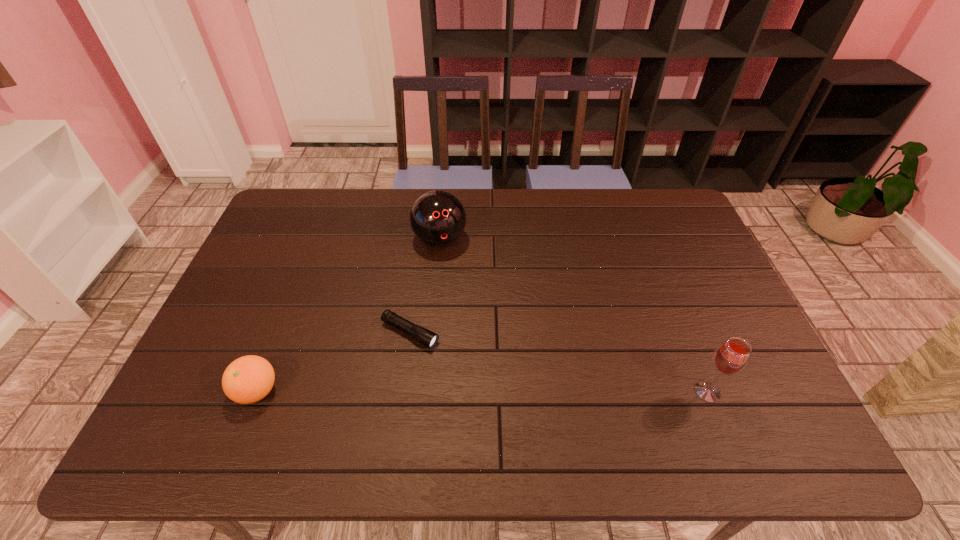
Where is `vacant area that lies between the farthest object and the leftmost object`? This screenshot has height=540, width=960. vacant area that lies between the farthest object and the leftmost object is located at coordinates (348, 315).

Image resolution: width=960 pixels, height=540 pixels. Find the location of `vacant space that's between the second farthest object and the orange`. vacant space that's between the second farthest object and the orange is located at coordinates (333, 362).

The height and width of the screenshot is (540, 960). In order to click on free space that is in between the orange and the shortest object in this screenshot , I will do `click(333, 362)`.

At what (x,y) coordinates should I click in order to perform the action: click on free space between the farthest object and the rightmost object. Please return your answer as a coordinate pair (x, y). This screenshot has width=960, height=540. Looking at the image, I should click on (574, 316).

Identify the location of free space between the second farthest object and the rightmost object. This screenshot has width=960, height=540. (559, 362).

Where is `unoccupied position between the second farthest object and the orange`? This screenshot has width=960, height=540. unoccupied position between the second farthest object and the orange is located at coordinates (333, 362).

Where is `vacant space that's between the shortest object and the rightmost object`? The width and height of the screenshot is (960, 540). vacant space that's between the shortest object and the rightmost object is located at coordinates [559, 362].

Select which object appears as the second closest to the bowling ball. Please provide its 2D coordinates. Your answer should be formatted as a tuple, i.e. [(x, y)], where the tuple contains the x and y coordinates of a point satisfying the conditions above.

[(248, 379)]

Identify which object is located as the nearest to the bowling ball. Please provide its 2D coordinates. Your answer should be formatted as a tuple, i.e. [(x, y)], where the tuple contains the x and y coordinates of a point satisfying the conditions above.

[(424, 336)]

Find the location of `vacant space that satisfies the following two spatial constraints: 1. on the front side of the farthest object; 2. on the right side of the rightmost object`. vacant space that satisfies the following two spatial constraints: 1. on the front side of the farthest object; 2. on the right side of the rightmost object is located at coordinates (425, 392).